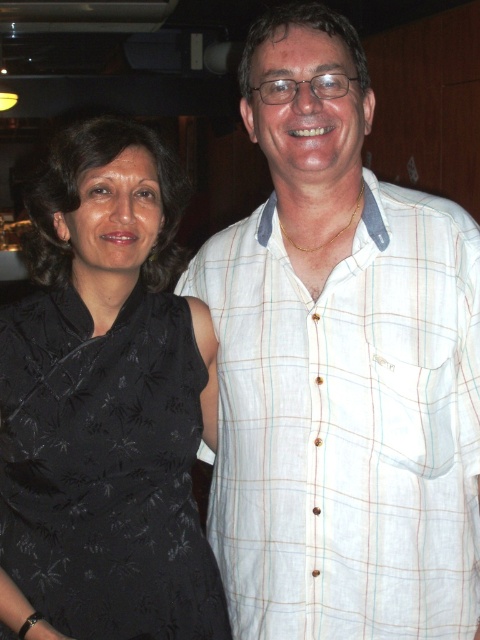
You are organizing a clothing donation drive and need to determine which item takes up more space in the donation box. Based on the image, which item is wider between the white plaid shirt at right and the black satin dress at left?

The white plaid shirt at right is wider than the black satin dress at left, so it takes up more space in the donation box.

You are a photographer at a social event and want to capture a photo of the white plaid shirt at right and the black satin dress at left. Which one is positioned closer to the camera?

The white plaid shirt at right is closer to the viewer than the black satin dress at left, so it will appear closer to the camera in the photo.